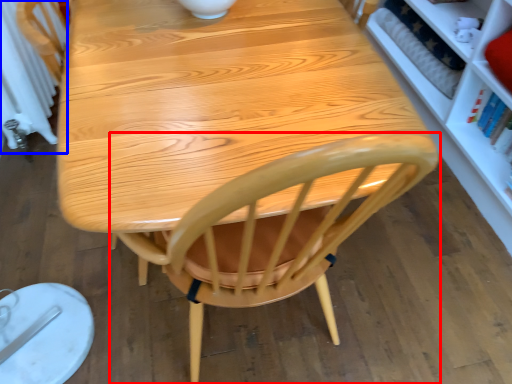
Question: Which point is further to the camera, chair (highlighted by a red box) or radiator (highlighted by a blue box)?

Choices:
 (A) chair
 (B) radiator

Answer: (B)